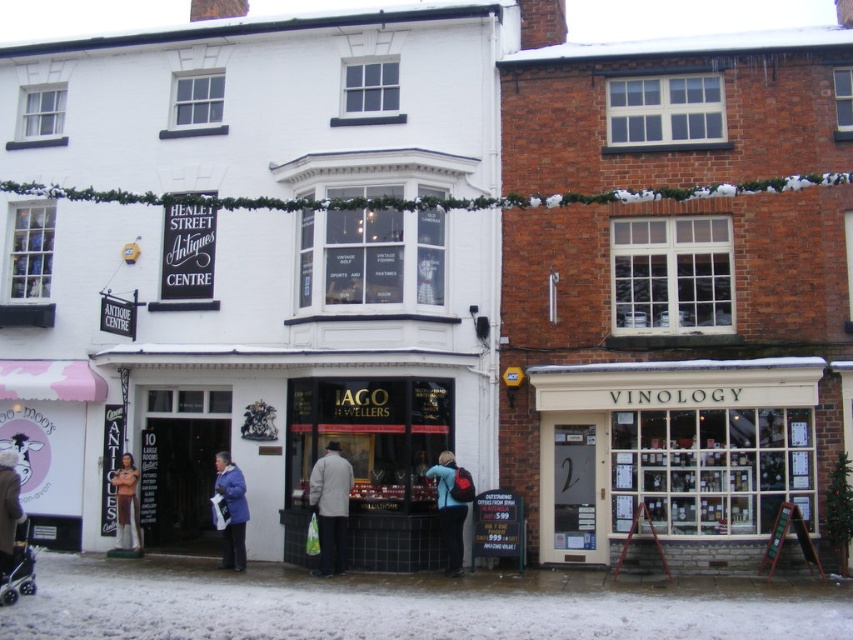
You are a customer at the Henley Street Antiques Centre and want to place a matte black backpack at center on the shelf. The shelf can only hold items that are to the right of the matte black jewelry at center. Can you place the backpack there?

The matte black jewelry at center is positioned on the left side of the matte black backpack at center, so the backpack is to the right of the jewelry. Therefore, you can place the matte black backpack at center on the shelf.

From the picture: You are a customer looking for a gift. You see the matte black jewelry at center in the image. Where exactly is it located in the store?

The matte black jewelry at center is located at point (322, 451) in the store.

You are a delivery person who needs to place both the white snow at ground center and the matte black jewelry at center on a shelf. The shelf can only hold items that are at least 10 cm in size. Which item should you place first to ensure both fit?

The white snow at ground center is smaller than the matte black jewelry at center. Since the shelf requires items to be at least 10 cm, you should place the matte black jewelry at center first to ensure it meets the size requirement, and then check if the white snow also qualifies.